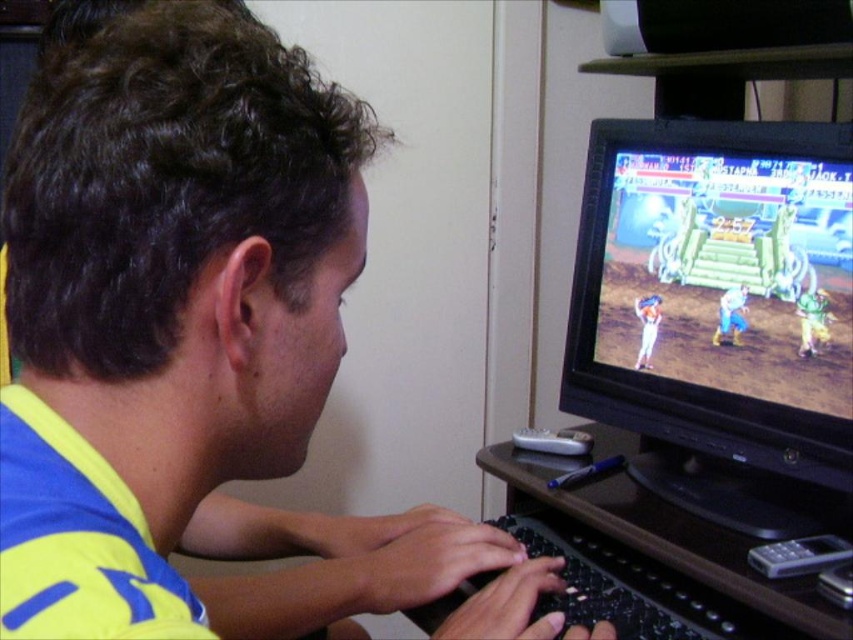
Describe the element at coordinates (198, 348) in the screenshot. The height and width of the screenshot is (640, 853). I see `blue/yellow jersey at center` at that location.

How distant is blue/yellow jersey at center from black glossy monitor at right?

They are 24.04 inches apart.

Where is `blue/yellow jersey at center`? blue/yellow jersey at center is located at coordinates (198, 348).

Can you confirm if blue/yellow jersey at center is wider than black plastic keyboard at lower center?

No.

Is point (84, 232) less distant than point (689, 628)?

Yes, it is.

Where is `blue/yellow jersey at center`? The height and width of the screenshot is (640, 853). blue/yellow jersey at center is located at coordinates (198, 348).

Describe the element at coordinates (720, 314) in the screenshot. I see `black glossy monitor at right` at that location.

What are the coordinates of `black glossy monitor at right` in the screenshot? It's located at (720, 314).

Is point (735, 360) behind point (422, 618)?

Yes, it is behind point (422, 618).

Locate an element on the screen. The width and height of the screenshot is (853, 640). black glossy monitor at right is located at coordinates (x=720, y=314).